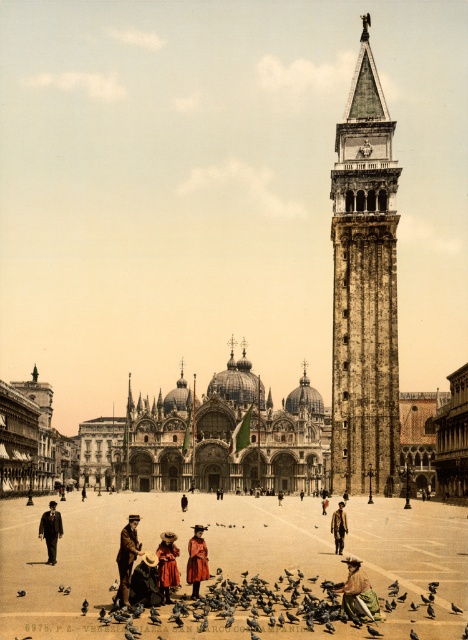
Who is positioned more to the left, matte red dress at center or dark gray feathered bird at center?

matte red dress at center is more to the left.

Image resolution: width=468 pixels, height=640 pixels. What do you see at coordinates (167, 564) in the screenshot? I see `matte red dress at center` at bounding box center [167, 564].

Between point (163, 582) and point (454, 612), which one is positioned behind?

Positioned behind is point (163, 582).

Where is `matte red dress at center`? matte red dress at center is located at coordinates (167, 564).

Between point (336, 513) and point (185, 506), which one is positioned behind?

The point (185, 506) is behind.

From the picture: Which is below, brown leather coat at center or brown leather jacket at center?

brown leather jacket at center is lower down.

Find the location of a particular element. The image size is (468, 640). brown leather coat at center is located at coordinates (338, 528).

You are a GUI agent. You are given a task and a screenshot of the screen. Output one action in this format:
    pyautogui.click(x=<x>, y=<y>)
    Task: Click on the brown leather coat at center
    The image size is (468, 640).
    Given the screenshot: What is the action you would take?
    pyautogui.click(x=338, y=528)

Locate an element on the screen. red velvet coat at center is located at coordinates (x=197, y=561).

In the scene shown: Who is more forward, (190, 547) or (53, 557)?

Positioned in front is point (190, 547).

Between point (196, 541) and point (45, 512), which one is positioned in front?

Point (196, 541)

Find the location of a particular element. red velvet coat at center is located at coordinates (197, 561).